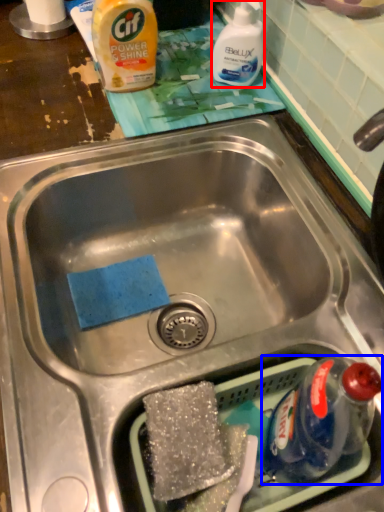
Question: Among these objects, which one is farthest to the camera, cleaning product (highlighted by a red box) or bottle (highlighted by a blue box)?

Choices:
 (A) cleaning product
 (B) bottle

Answer: (A)